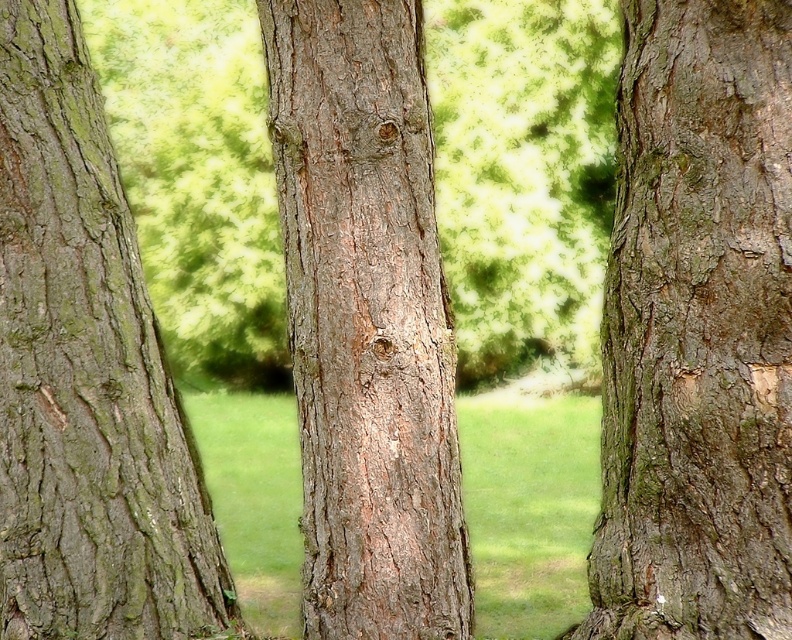
You are a hiker trying to determine the best tree to carve a message on for visibility. Considering the green rough bark tree at right and the smooth brown bark at center, which tree would be easier to carve into based on their bark texture?

The smooth brown bark at center would be easier to carve into because its surface is smoother compared to the green rough bark tree at right.

You are standing in front of the three tree trunks and notice a specific point marked at coordinates point (366, 321). Based on the scene description, what characteristic does the bark at this point have?

The point (366, 321) indicates smooth brown bark at center.